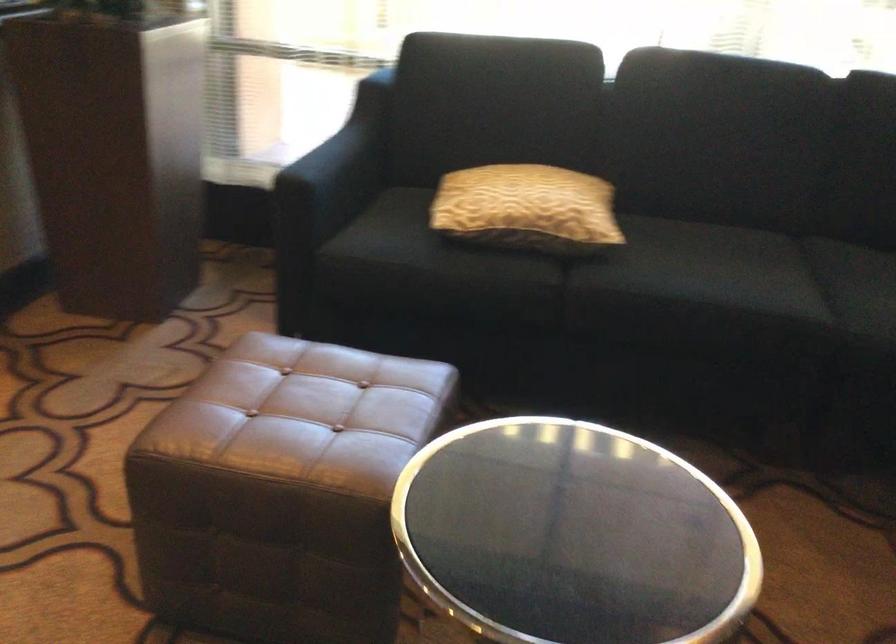
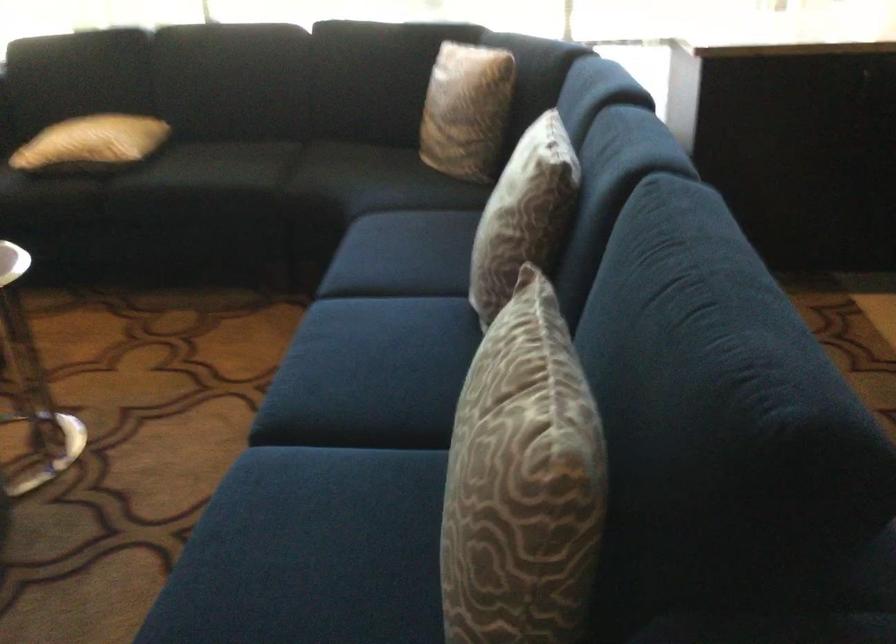
The images are taken continuously from a first-person perspective. In which direction are you moving?

The cameraman moved toward right, backward.